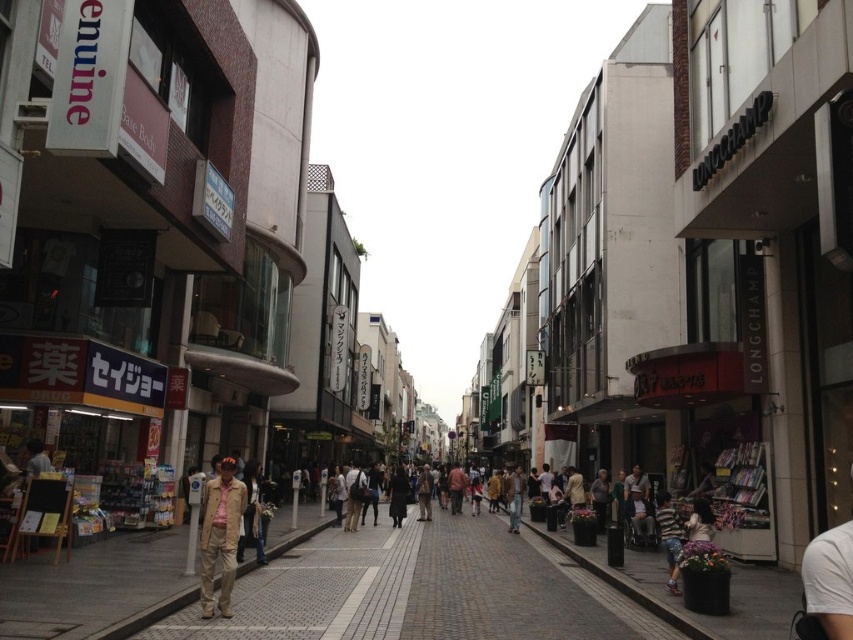
You are a delivery person carrying a package and need to walk from the brick pavement at center to the tan fabric jacket at lower left. Is the path between them wide enough for you to pass through comfortably?

The brick pavement at center might be wider than tan fabric jacket at lower left, but the description does not provide specific measurements. Therefore, it is uncertain if the path is wide enough for comfortable passage.

You are a delivery person standing on the brick pavement at center and need to pick up a package from the tan fabric jacket at lower left. Which direction should you move to reach it?

The brick pavement at center is to the right of the tan fabric jacket at lower left, so you should move to the left to reach it.

You are a delivery person who needs to place a large package on the ground in the urban street scene. The package is too big to carry and must be placed on the brick pavement at center or the tan fabric jacket at lower left. Which location can accommodate the package based on their sizes?

The brick pavement at center is larger in size than the tan fabric jacket at lower left, so the package should be placed on the brick pavement at center.